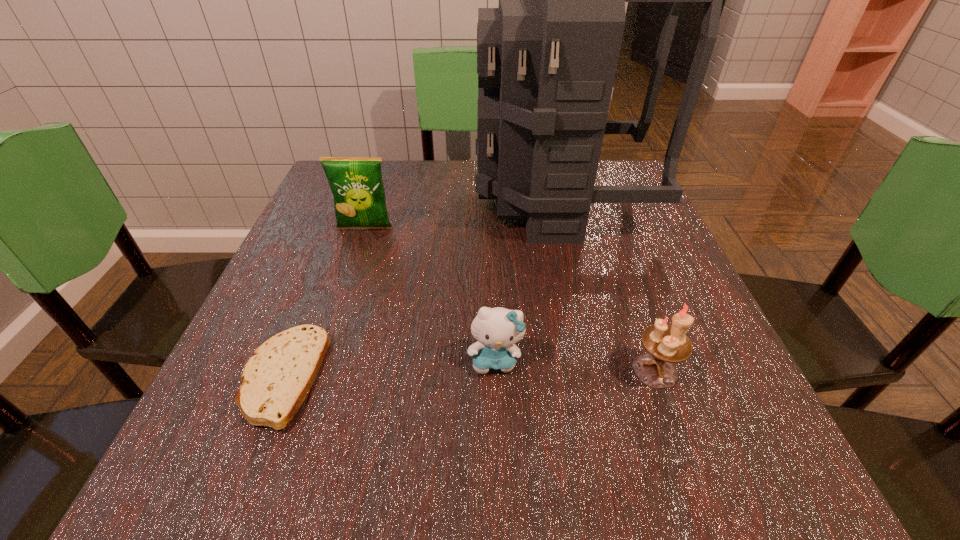
This screenshot has width=960, height=540. Find the location of `vacant region between the third tallest object and the crisp (potato chip)`. vacant region between the third tallest object and the crisp (potato chip) is located at coordinates (510, 299).

You are a GUI agent. You are given a task and a screenshot of the screen. Output one action in this format:
    pyautogui.click(x=<x>, y=<y>)
    Task: Click on the free space between the shortest object and the third tallest object
    The image size is (960, 540).
    Given the screenshot: What is the action you would take?
    pyautogui.click(x=468, y=374)

You are a GUI agent. You are given a task and a screenshot of the screen. Output one action in this format:
    pyautogui.click(x=<x>, y=<y>)
    Task: Click on the free space between the second tallest object and the tallest object
    
    Given the screenshot: What is the action you would take?
    pyautogui.click(x=463, y=214)

The width and height of the screenshot is (960, 540). What are the coordinates of `vacant point located between the backpack and the fourth shortest object` in the screenshot? It's located at (463, 214).

Locate an element on the screen. The image size is (960, 540). object that is the third closest to the shortest object is located at coordinates (547, 57).

Select which object is the second closest to the backpack. Please provide its 2D coordinates. Your answer should be formatted as a tuple, i.e. [(x, y)], where the tuple contains the x and y coordinates of a point satisfying the conditions above.

[(497, 330)]

Identify the location of vacant area in the image that satisfies the following two spatial constraints: 1. on the face of the candle holder; 2. on the left side of the fourth tallest object. point(495,370).

In order to click on vacant space that satisfies the following two spatial constraints: 1. on the front-facing side of the second tallest object; 2. on the left side of the candle holder in this screenshot , I will do `click(318, 370)`.

Where is `vacant space that satisfies the following two spatial constraints: 1. on the front compartment of the backpack; 2. on the front side of the pita bread`? vacant space that satisfies the following two spatial constraints: 1. on the front compartment of the backpack; 2. on the front side of the pita bread is located at coordinates coord(604,379).

Identify the location of free space that satisfies the following two spatial constraints: 1. on the front-facing side of the fourth shortest object; 2. on the right side of the candle holder. Image resolution: width=960 pixels, height=540 pixels. (318, 370).